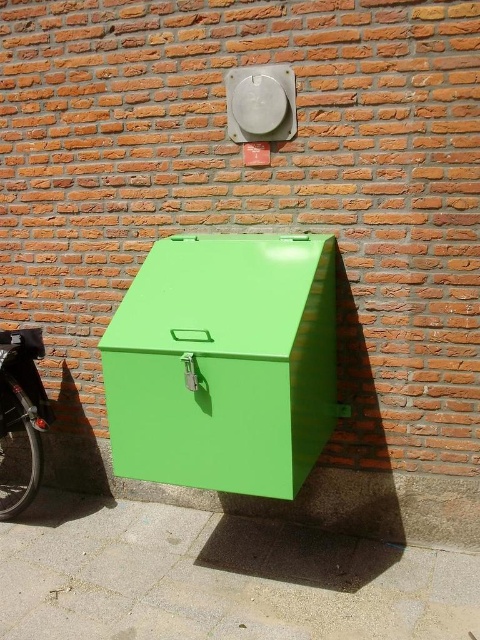
Is green metallic box at center taller than shiny black bicycle at lower left?

Correct, green metallic box at center is much taller as shiny black bicycle at lower left.

The image size is (480, 640). In order to click on green metallic box at center in this screenshot , I will do `click(225, 364)`.

Can you confirm if green matte pavement at lower center is positioned to the right of green metallic box at center?

Incorrect, green matte pavement at lower center is not on the right side of green metallic box at center.

Does point (259, 547) come behind point (165, 308)?

Yes.

Find the location of a particular element. This screenshot has height=640, width=480. green matte pavement at lower center is located at coordinates (218, 579).

Find the location of a particular element. The width and height of the screenshot is (480, 640). green matte pavement at lower center is located at coordinates (218, 579).

Can you confirm if green matte pavement at lower center is thinner than shiny black bicycle at lower left?

No, green matte pavement at lower center is not thinner than shiny black bicycle at lower left.

Describe the element at coordinates (218, 579) in the screenshot. Image resolution: width=480 pixels, height=640 pixels. I see `green matte pavement at lower center` at that location.

The width and height of the screenshot is (480, 640). In order to click on green matte pavement at lower center in this screenshot , I will do `click(218, 579)`.